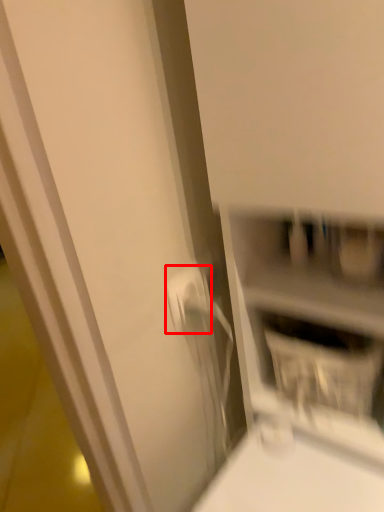
Question: In this image, where is electric outlet (annotated by the red box) located relative to shelf?

Choices:
 (A) right
 (B) left

Answer: (B)